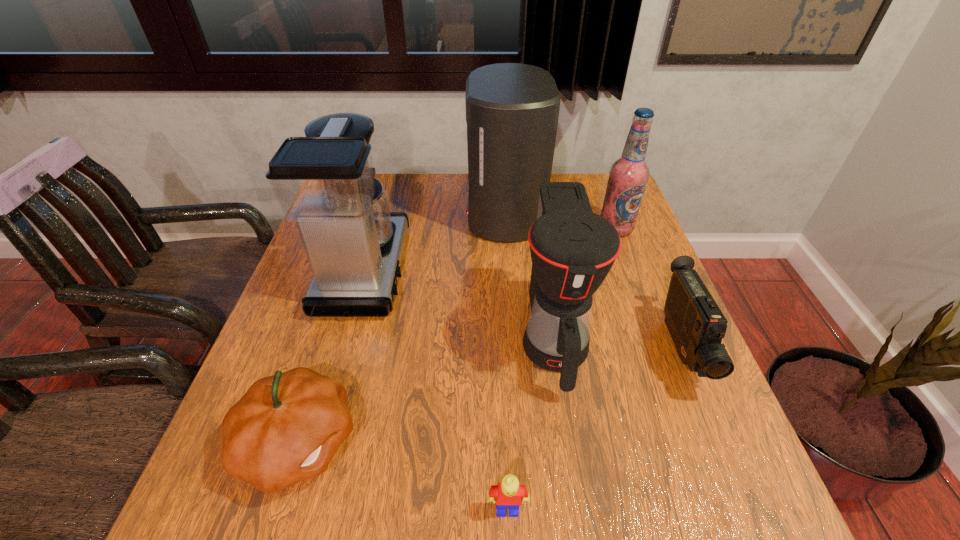
Find the location of `the leftmost coffee maker`. the leftmost coffee maker is located at coordinates (324, 182).

Locate an element on the screen. alcohol is located at coordinates (628, 176).

In order to click on the shortest coffee maker in this screenshot , I will do `click(572, 249)`.

Identify the location of camcorder. The height and width of the screenshot is (540, 960). (697, 325).

The image size is (960, 540). What are the coordinates of `pumpkin` in the screenshot? It's located at (286, 428).

In order to click on Lego in this screenshot , I will do `click(509, 493)`.

This screenshot has height=540, width=960. In order to click on vacant space positioned at the front of the leftmost coffee maker where the controls are located in this screenshot , I will do `click(545, 270)`.

In order to click on free space located on the back of the alcohol in this screenshot , I will do `click(596, 179)`.

Find the location of `vacant point located 0.210m pour from the carafe of the shortest coffee maker`. vacant point located 0.210m pour from the carafe of the shortest coffee maker is located at coordinates click(583, 521).

Locate an element on the screen. The height and width of the screenshot is (540, 960). free space located on the front-facing side of the camcorder is located at coordinates (727, 458).